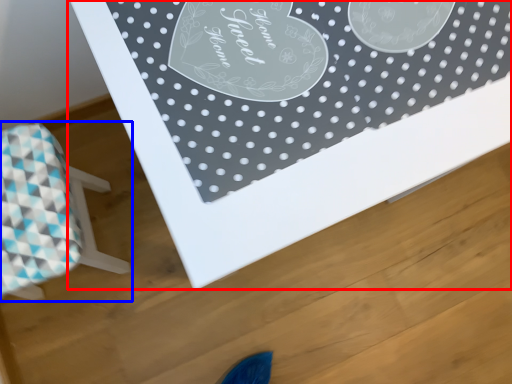
Question: Among these objects, which one is nearest to the camera, table (highlighted by a red box) or furniture (highlighted by a blue box)?

Choices:
 (A) table
 (B) furniture

Answer: (A)